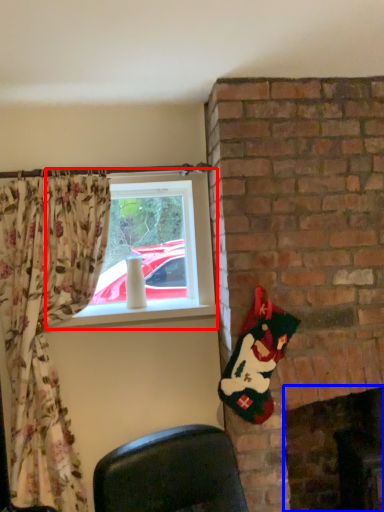
Question: Which point is closer to the camera, window (highlighted by a red box) or fireplace (highlighted by a blue box)?

Choices:
 (A) window
 (B) fireplace

Answer: (B)